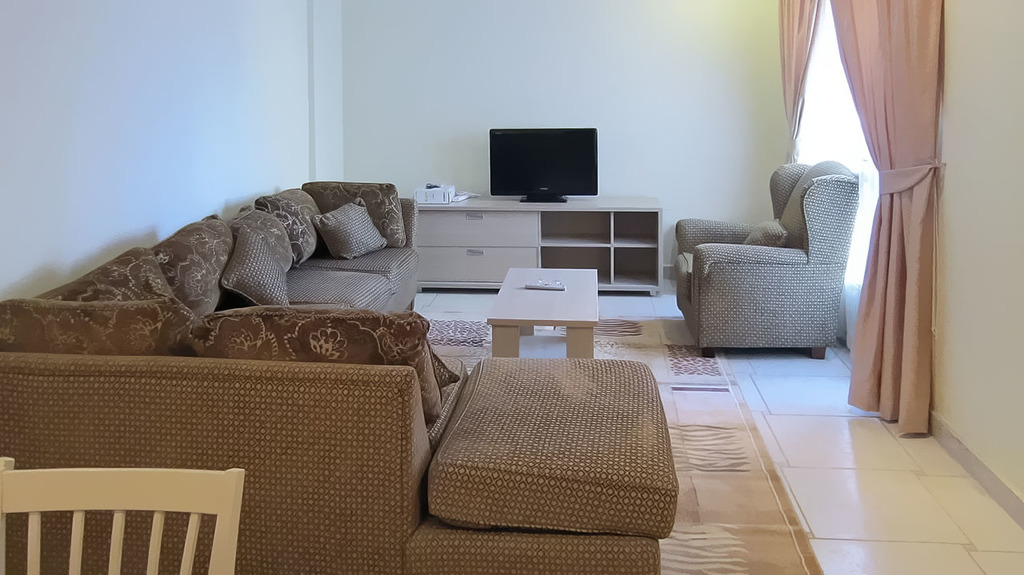
You are a GUI agent. You are given a task and a screenshot of the screen. Output one action in this format:
    pyautogui.click(x=<x>, y=<y>)
    Task: Click on the tan chair
    
    Given the screenshot: What is the action you would take?
    pyautogui.click(x=777, y=294)